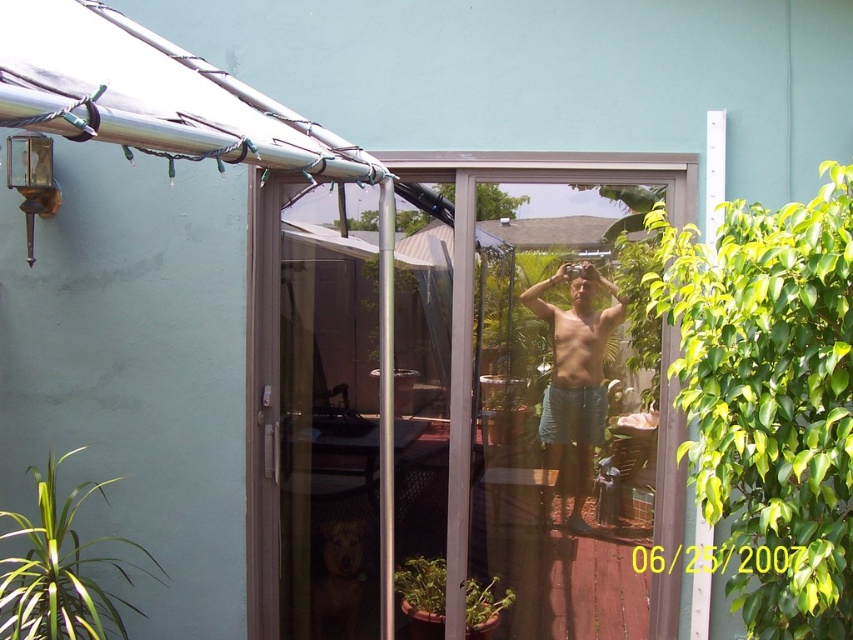
You are standing in front of the sliding glass door and notice two points marked on the wall. The first point is at coordinates point (554,387) and the second is at point (606,339). Which point is closer to your current position?

Point (554,387) is further to the camera than point (606,339), so the second point is closer to your position.

You are a photographer trying to capture a clear shot of the man in the scene. The matte blue shorts at center and the muscle at center are both in the frame. Which one should you focus on to ensure the subject is sharp, considering their sizes?

The matte blue shorts at center has a greater height compared to the muscle at center, so focusing on the larger matte blue shorts at center would ensure the subject is sharp.

You are standing in front of the sliding glass door and want to determine which of the two points, point (680, 492) or point (567, 380), is closer to you. Based on the scene description, which point is closer?

Point (680, 492) is closer to the camera than point (567, 380).